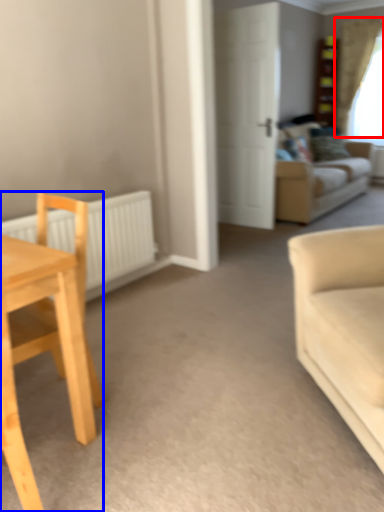
Question: Which object is closer to the camera taking this photo, curtain (highlighted by a red box) or chair (highlighted by a blue box)?

Choices:
 (A) curtain
 (B) chair

Answer: (B)